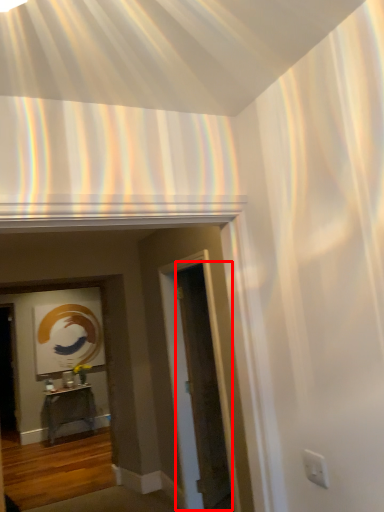
Question: From the image's perspective, what is the correct spatial positioning of glass door (annotated by the red box) in reference to table?

Choices:
 (A) above
 (B) below

Answer: (A)